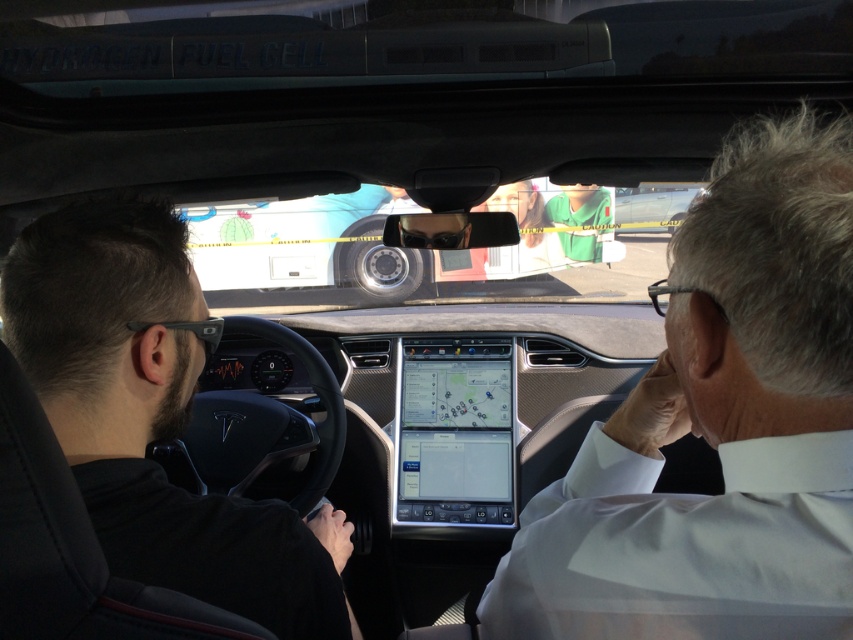
Can you confirm if white shirt at center is taller than black matte jacket at left?

Yes.

Is white shirt at center closer to camera compared to black matte jacket at left?

Yes.

Is point (782, 246) positioned before point (99, 310)?

Yes.

What are the coordinates of `white shirt at center` in the screenshot? It's located at (718, 428).